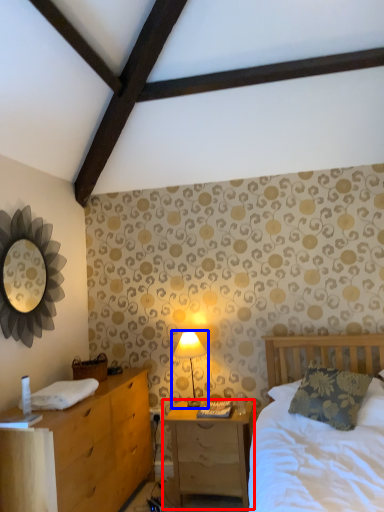
Question: Which object is further to the camera taking this photo, nightstand (highlighted by a red box) or table lamp (highlighted by a blue box)?

Choices:
 (A) nightstand
 (B) table lamp

Answer: (B)